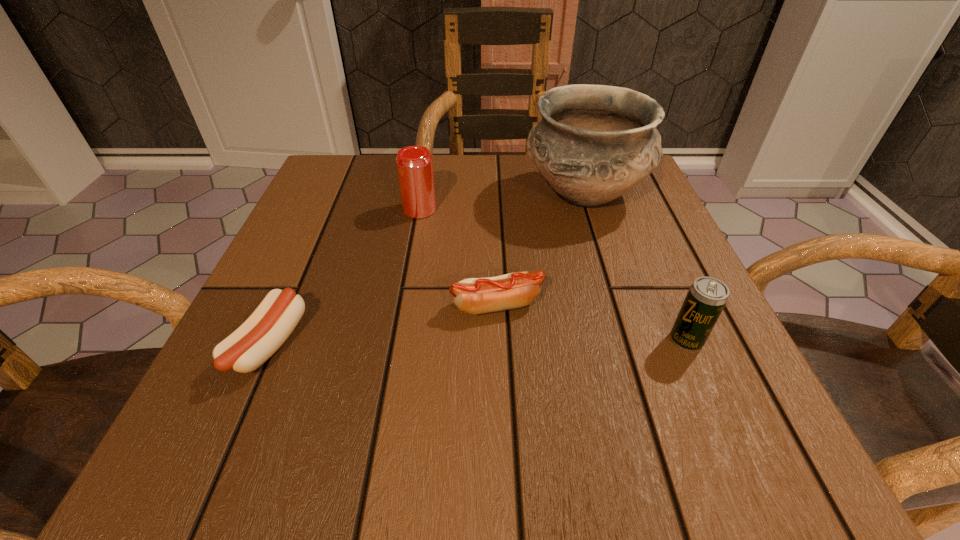
Where is `vacant area that lies between the right sausage and the left sausage`? vacant area that lies between the right sausage and the left sausage is located at coordinates click(x=383, y=325).

In order to click on vacant space in between the right sausage and the leftmost object in this screenshot , I will do `click(383, 325)`.

This screenshot has width=960, height=540. Find the location of `free space between the left sausage and the pottery`. free space between the left sausage and the pottery is located at coordinates (426, 270).

Identify the location of object that is the closest to the fourth object from right to left. This screenshot has width=960, height=540. (594, 143).

Identify the location of object that stands as the closest to the fourth object from right to left. This screenshot has width=960, height=540. (594, 143).

Locate an element on the screen. The height and width of the screenshot is (540, 960). free space that satisfies the following two spatial constraints: 1. on the back side of the third tallest object; 2. on the right side of the left sausage is located at coordinates [x=271, y=340].

At what (x,y) coordinates should I click in order to perform the action: click on vacant space that satisfies the following two spatial constraints: 1. on the back side of the pottery; 2. on the left side of the right sausage. Please return your answer as a coordinate pair (x, y). The height and width of the screenshot is (540, 960). Looking at the image, I should click on (493, 195).

I want to click on free space that satisfies the following two spatial constraints: 1. on the back side of the leftmost object; 2. on the left side of the farther beer can, so (328, 210).